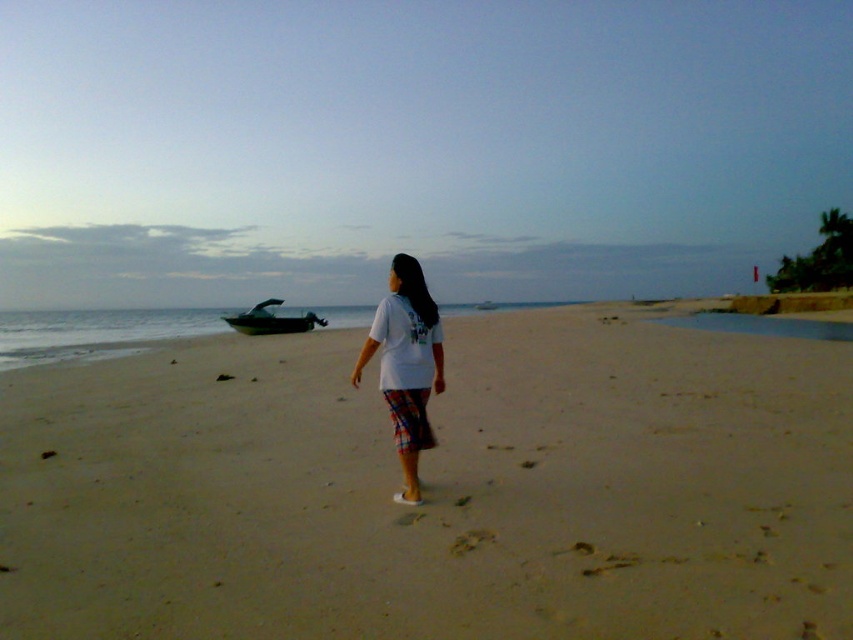
In the scene shown: Does light brown sand at center appear over white cotton shirt at center?

Actually, light brown sand at center is below white cotton shirt at center.

Does light brown sand at center appear on the right side of white cotton shirt at center?

In fact, light brown sand at center is to the left of white cotton shirt at center.

Locate an element on the screen. Image resolution: width=853 pixels, height=640 pixels. light brown sand at center is located at coordinates (x=434, y=490).

Does point (769, 380) come behind point (231, 320)?

That is False.

Find the location of a particular element. This screenshot has width=853, height=640. light brown sand at center is located at coordinates (434, 490).

Does white cotton shirt at center have a lesser width compared to metallic silver boat at left?

Yes, white cotton shirt at center is thinner than metallic silver boat at left.

Who is taller, white cotton shirt at center or metallic silver boat at left?

Standing taller between the two is white cotton shirt at center.

Which is behind, point (374, 332) or point (270, 330)?

The point (270, 330) is more distant.

The height and width of the screenshot is (640, 853). I want to click on white cotton shirt at center, so click(405, 364).